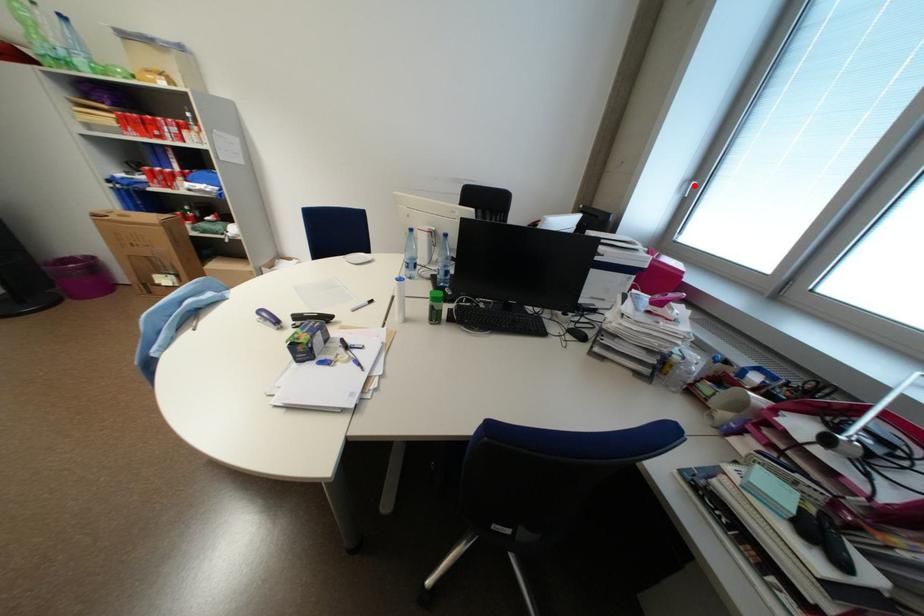
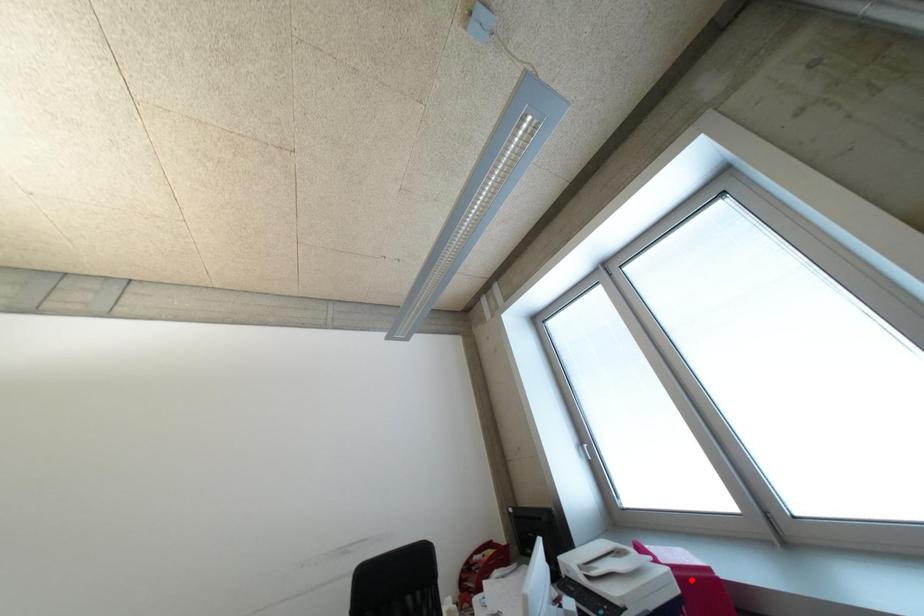
From the picture: I am providing you with two images of the same scene from different viewpoints. A red point is marked on the first image and another point is marked on the second image. Are the points marked in image1 and image2 representing the same 3D position?

No